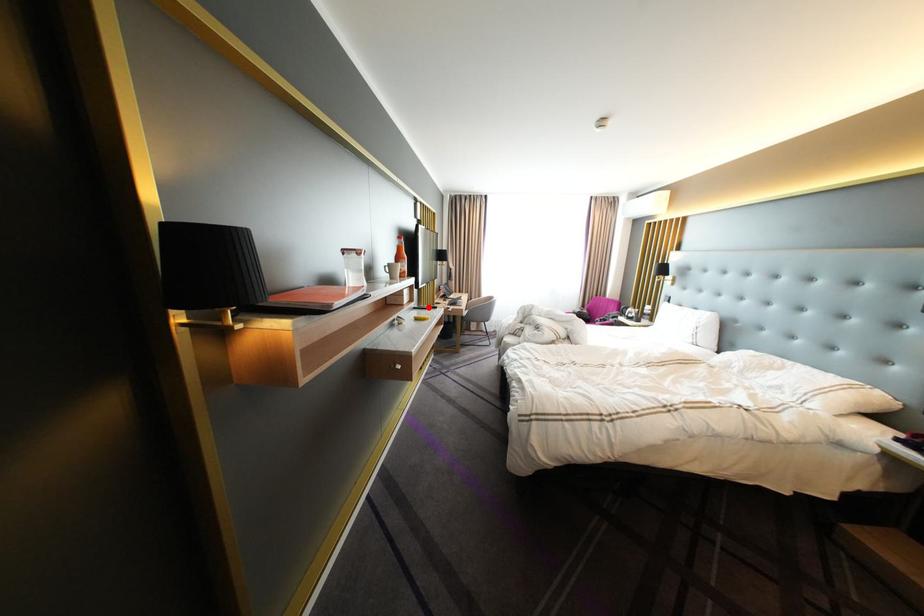
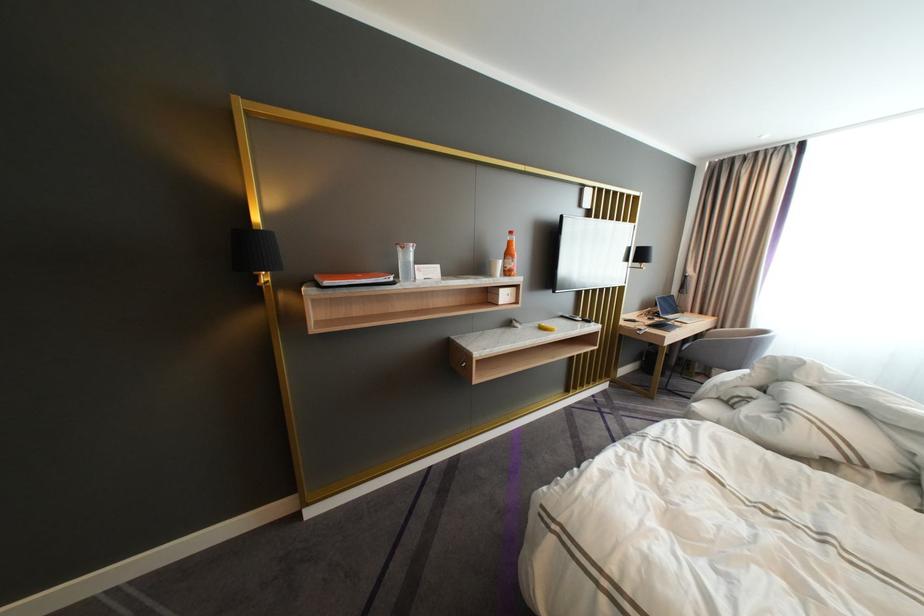
Find the pixel in the second image that matches the highlighted location in the first image.

(578, 315)